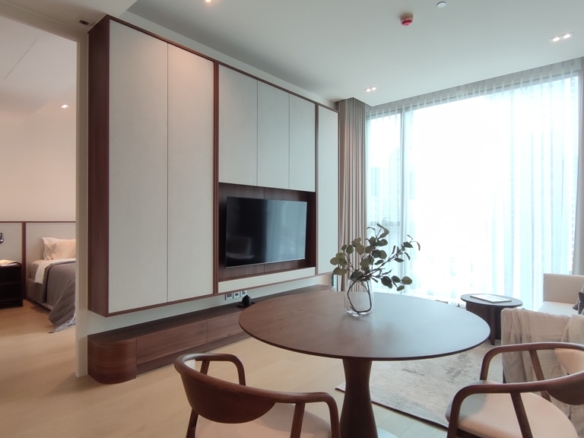
Identify the location of sofa. The image size is (584, 438). (556, 316).